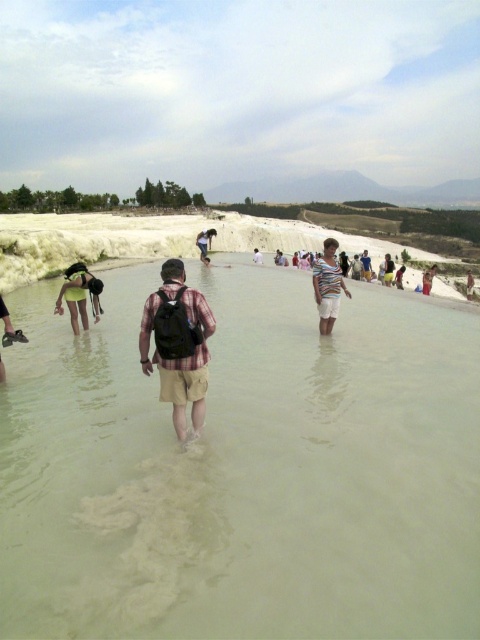
You are a tourist visiting the hot spring area and you see the greenish murky water at center and the light blue denim shorts at center. Which object is higher in the scene?

The greenish murky water at center is much taller than the light blue denim shorts at center.

You are a photographer trying to capture the plaid fabric shirt at center and the light blue denim shorts at center in the same frame. Which object should you focus on first if you want to ensure both are in focus?

The plaid fabric shirt at center is smaller than light blue denim shorts at center, so you should focus on the light blue denim shorts at center first because larger objects often require more precise focusing to ensure clarity in the frame.

You are a photographer planning to capture a candid shot of the light blue denim shorts at center and the greenish murky water at center. Based on their sizes, which one should you focus on to ensure the subject fills the frame better?

The greenish murky water at center is bigger than the light blue denim shorts at center, so focusing on the greenish murky water at center will ensure it fills the frame better.